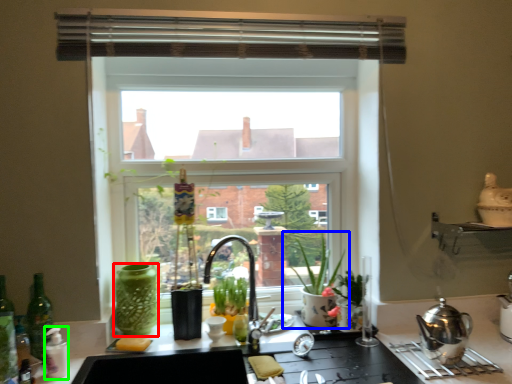
Question: Considering the real-world distances, which object is farthest from glass vase (highlighted by a red box)? houseplant (highlighted by a blue box) or bottle (highlighted by a green box)?

Choices:
 (A) houseplant
 (B) bottle

Answer: (A)